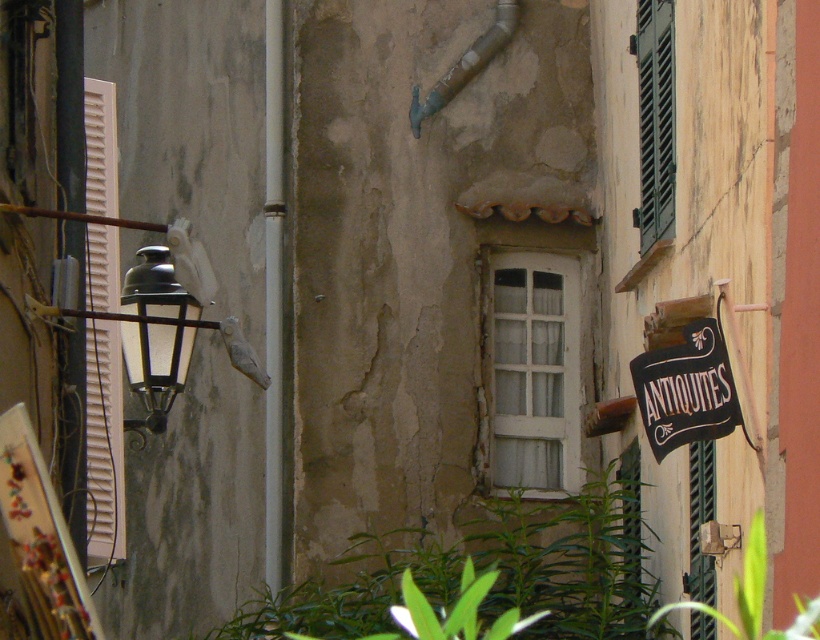
Question: Based on their relative distances, which object is nearer to the green wooden shutters at upper right?

Choices:
 (A) green leafy plant at lower right
 (B) white wooden window at center
 (C) matte black lantern at left
 (D) white wooden shutters at left

Answer: (B)

Question: Can you confirm if white wooden shutters at left is positioned above green leafy plant at lower right?

Choices:
 (A) yes
 (B) no

Answer: (A)

Question: Is white wooden shutters at left bigger than black fabric sign at right?

Choices:
 (A) no
 (B) yes

Answer: (B)

Question: Does black fabric sign at right appear under green leafy plant at lower right?

Choices:
 (A) no
 (B) yes

Answer: (A)

Question: Which object appears farthest from the camera in this image?

Choices:
 (A) green leafy plant at lower right
 (B) black fabric sign at right

Answer: (A)

Question: Which point is farther to the camera?

Choices:
 (A) (647, 109)
 (B) (654, 616)
 (C) (695, 388)

Answer: (A)